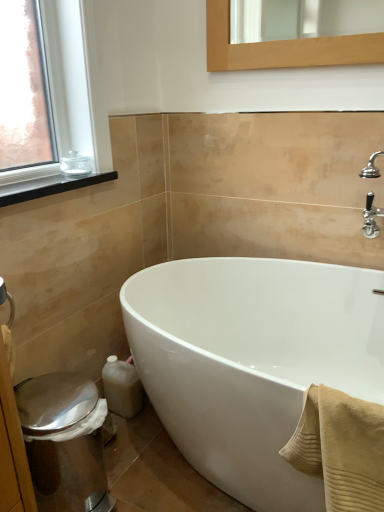
Question: From a real-world perspective, is shiny metallic bidet at lower left above or below white glossy bathtub at center?

Choices:
 (A) above
 (B) below

Answer: (B)

Question: Visually, is shiny metallic bidet at lower left positioned to the left or to the right of white glossy bathtub at center?

Choices:
 (A) left
 (B) right

Answer: (A)

Question: Which object is the farthest from the white glossy bathtub at center?

Choices:
 (A) shiny metallic bidet at lower left
 (B) beige ribbed towel at lower right
 (C) black matte window sill at upper left
 (D) clear glass jar at upper left

Answer: (D)

Question: Based on their relative distances, which object is farther from the clear glass jar at upper left?

Choices:
 (A) white glossy bathtub at center
 (B) beige ribbed towel at lower right
 (C) black matte window sill at upper left
 (D) shiny metallic bidet at lower left

Answer: (B)